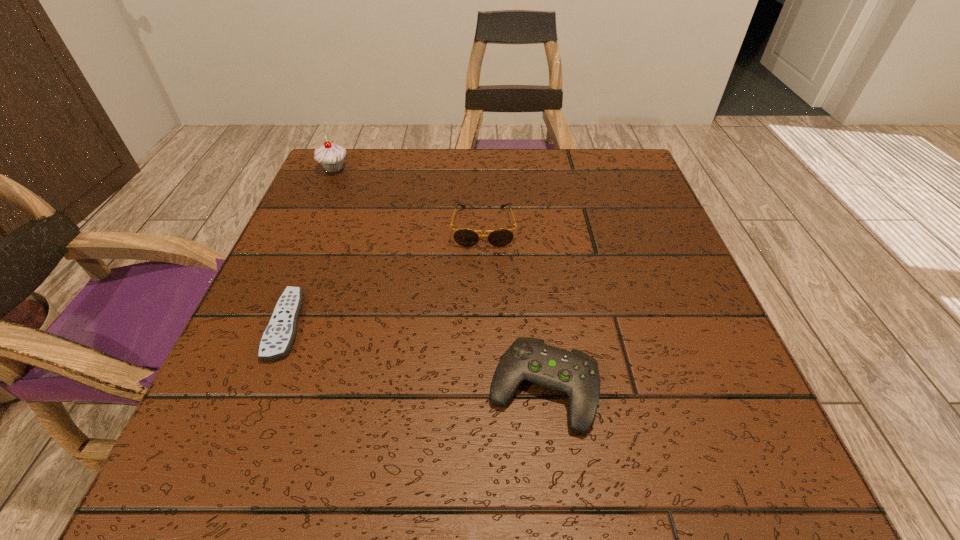
Where is `the closest object to the third nearest object`? The height and width of the screenshot is (540, 960). the closest object to the third nearest object is located at coordinates click(x=574, y=373).

Choose which object is the second nearest neighbor to the control. Please provide its 2D coordinates. Your answer should be formatted as a tuple, i.e. [(x, y)], where the tuple contains the x and y coordinates of a point satisfying the conditions above.

[(277, 339)]

Where is `free spot that satisfies the following two spatial constraints: 1. on the front side of the control; 2. on the left side of the farthest object`? This screenshot has height=540, width=960. free spot that satisfies the following two spatial constraints: 1. on the front side of the control; 2. on the left side of the farthest object is located at coordinates (238, 389).

You are a GUI agent. You are given a task and a screenshot of the screen. Output one action in this format:
    pyautogui.click(x=<x>, y=<y>)
    Task: Click on the free space that satisfies the following two spatial constraints: 1. on the lenses of the control; 2. on the left side of the sunglasses
    This screenshot has height=540, width=960.
    Given the screenshot: What is the action you would take?
    pyautogui.click(x=485, y=389)

At what (x,y) coordinates should I click in order to perform the action: click on vacant space that satisfies the following two spatial constraints: 1. on the lenses of the second farthest object; 2. on the left side of the control. Please return your answer as a coordinate pair (x, y). Looking at the image, I should click on pos(485,389).